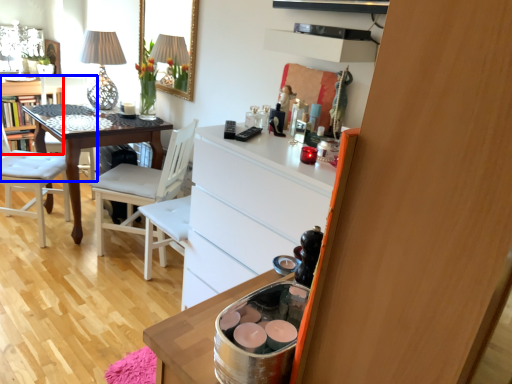
Question: Which object is further to the camera taking this photo, vanity (highlighted by a red box) or chair (highlighted by a blue box)?

Choices:
 (A) vanity
 (B) chair

Answer: (A)